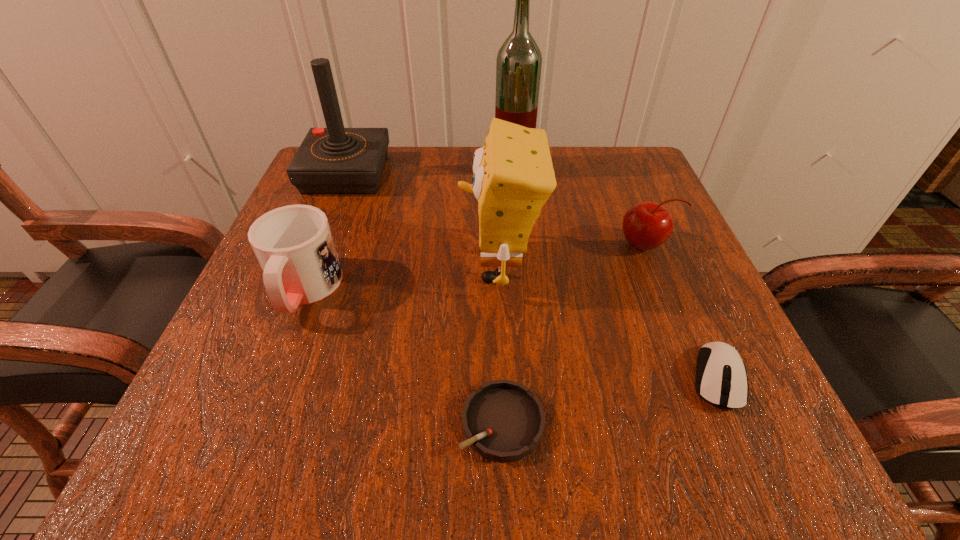
Identify the location of joystick present at the left edge. (335, 160).

Where is `mug situated at the left edge`? The image size is (960, 540). mug situated at the left edge is located at coordinates (294, 245).

Where is `cherry that is positioned at the right edge`? cherry that is positioned at the right edge is located at coordinates (646, 225).

What are the coordinates of `mouse that is at the right edge` in the screenshot? It's located at (721, 379).

The image size is (960, 540). What are the coordinates of `object present at the far left corner` in the screenshot? It's located at (335, 160).

Locate an element on the screen. This screenshot has width=960, height=540. object located in the near right corner section of the desktop is located at coordinates (721, 379).

Identify the location of free space at the far edge of the desktop. Image resolution: width=960 pixels, height=540 pixels. (445, 202).

Identify the location of vacant space at the left edge. (254, 276).

Identify the location of vacant area at the right edge. (700, 309).

In the image, there is a desktop. In order to click on vacant region at the near left corner in this screenshot , I will do `click(218, 456)`.